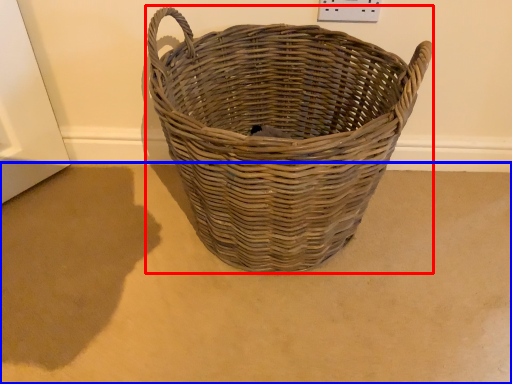
Question: Which point is further to the camera, picnic basket (highlighted by a red box) or plain (highlighted by a blue box)?

Choices:
 (A) picnic basket
 (B) plain

Answer: (B)